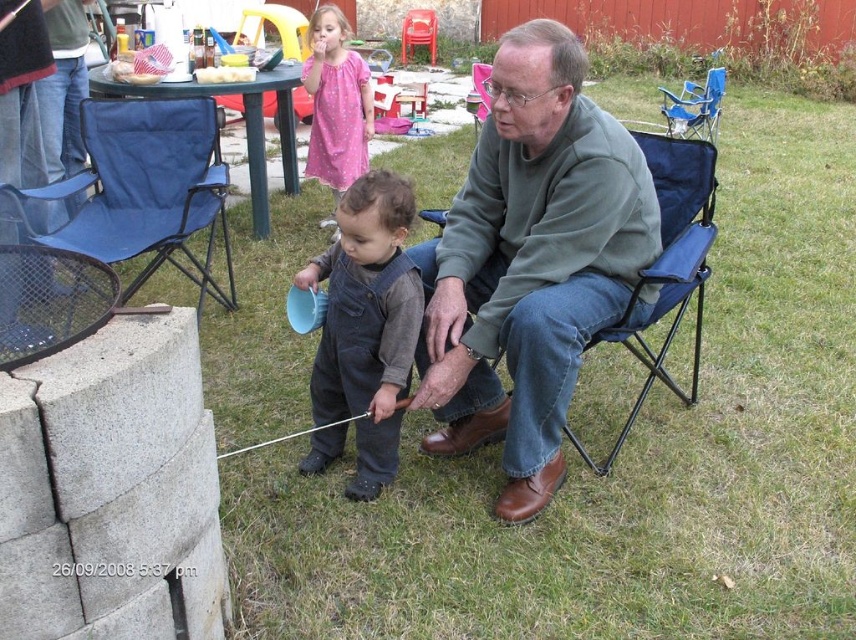
You are organizing a backyard event and need to arrange seating. You have a blue fabric chair at upper center and a denim overalls at center. Which object should you move to the right to create space for a new table?

The denim overalls at center should be moved to the right since it is currently on the left side of the blue fabric chair at upper center, so shifting it right would free up space for the new table.

Looking at this image, what is the exact location of the denim overalls at center in the image?

The denim overalls at center is located at point (367, 323).

You are a photographer trying to capture a candid shot of the man and child in the scene. The man is wearing a green cotton sweater at center, and the child is wearing denim overalls at center. Based on their positions, which clothing item is higher up in the frame?

The green cotton sweater at center is above denim overalls at center, so the man wearing the green cotton sweater at center is higher up in the frame than the child in denim overalls at center.